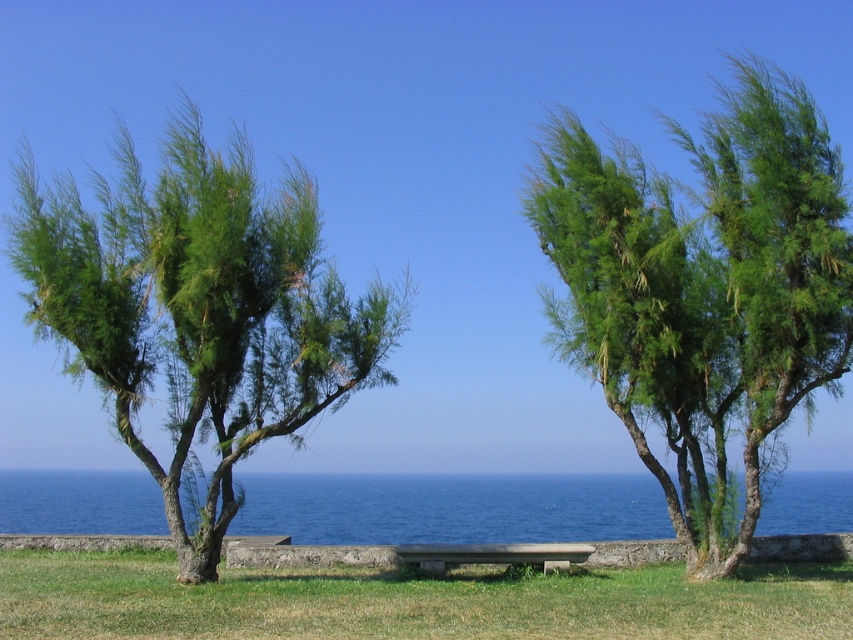
Question: Can you confirm if blue liquid water at center is thinner than smooth gray bench at center?

Choices:
 (A) yes
 (B) no

Answer: (B)

Question: Does green leafy tree at left have a greater width compared to blue liquid water at center?

Choices:
 (A) no
 (B) yes

Answer: (A)

Question: Among these points, which one is nearest to the camera?

Choices:
 (A) pyautogui.click(x=286, y=621)
 (B) pyautogui.click(x=172, y=385)
 (C) pyautogui.click(x=763, y=314)
 (D) pyautogui.click(x=404, y=563)

Answer: (A)

Question: Which point is farther to the camera?

Choices:
 (A) (822, 516)
 (B) (287, 221)
 (C) (770, 216)

Answer: (A)

Question: Can you confirm if green leafy tree at center is smaller than green grass at center?

Choices:
 (A) yes
 (B) no

Answer: (A)

Question: Among these objects, which one is nearest to the camera?

Choices:
 (A) green leafy tree at left
 (B) green grass at center
 (C) green leafy tree at center
 (D) blue liquid water at center

Answer: (B)